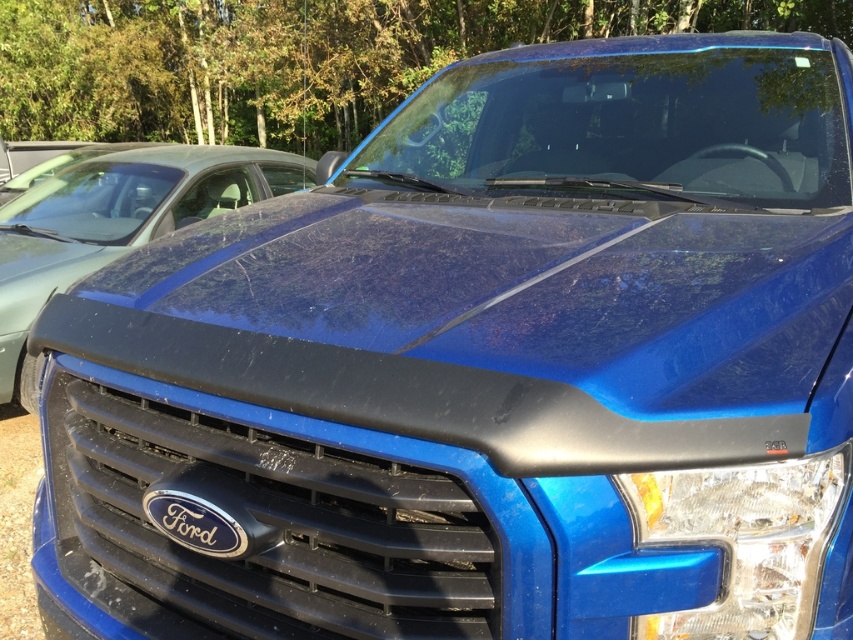
Question: Estimate the real-world distances between objects in this image. Which object is closer to the clear plastic headlight at lower right?

Choices:
 (A) matte black hood at center
 (B) black glossy ford emblem at center

Answer: (B)

Question: Does clear plastic headlight at lower right appear on the left side of black glossy ford emblem at center?

Choices:
 (A) no
 (B) yes

Answer: (A)

Question: Which object appears farthest from the camera in this image?

Choices:
 (A) clear plastic headlight at lower right
 (B) black glossy ford emblem at center

Answer: (B)

Question: Which point is closer to the camera taking this photo?

Choices:
 (A) (762, 513)
 (B) (196, 515)

Answer: (A)

Question: Can you confirm if clear plastic headlight at lower right is bigger than black glossy ford emblem at center?

Choices:
 (A) yes
 (B) no

Answer: (A)

Question: Can you confirm if clear plastic headlight at lower right is thinner than black glossy ford emblem at center?

Choices:
 (A) yes
 (B) no

Answer: (B)